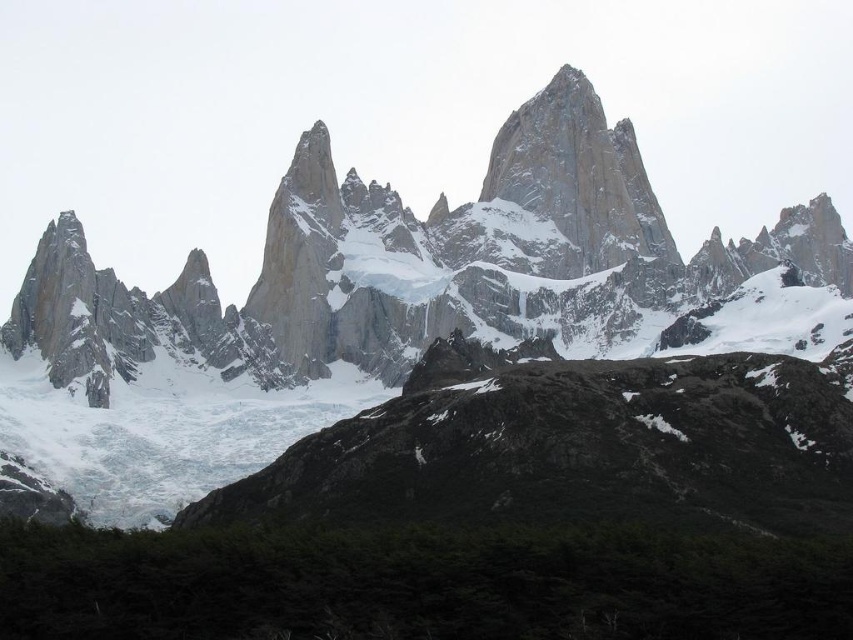
Question: Which point appears closest to the camera in this image?

Choices:
 (A) (525, 218)
 (B) (601, 193)

Answer: (B)

Question: Is granite rock formation at center wider than white snow-covered peak at center?

Choices:
 (A) yes
 (B) no

Answer: (A)

Question: Is granite rock formation at center to the left of white snow-covered peak at center from the viewer's perspective?

Choices:
 (A) yes
 (B) no

Answer: (A)

Question: Which point is closer to the camera?

Choices:
 (A) (332, 324)
 (B) (552, 122)

Answer: (A)

Question: Can you confirm if granite rock formation at center is positioned below white snow-covered peak at center?

Choices:
 (A) yes
 (B) no

Answer: (A)